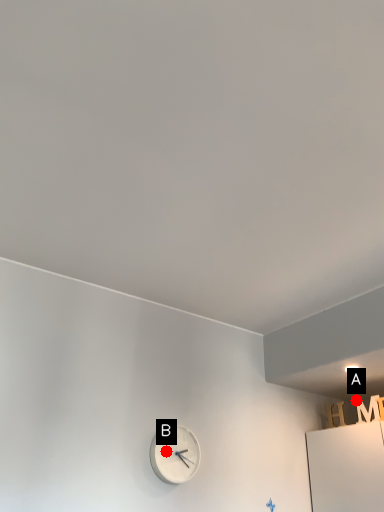
Question: Two points are circled on the image, labeled by A and B beside each circle. Which of the following is the farthest from the observer?

Choices:
 (A) A is further
 (B) B is further

Answer: (A)